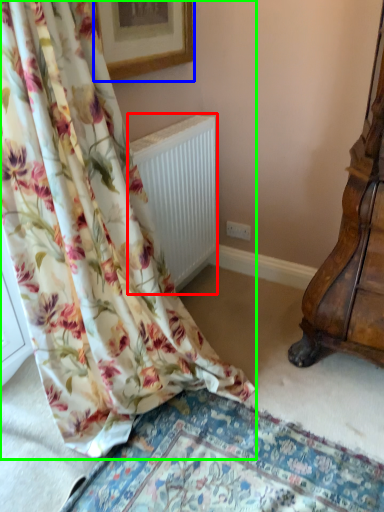
Question: Based on their relative distances, which object is nearer to radiator (highlighted by a red box)? Choose from picture frame (highlighted by a blue box) and curtain (highlighted by a green box).

Choices:
 (A) picture frame
 (B) curtain

Answer: (A)